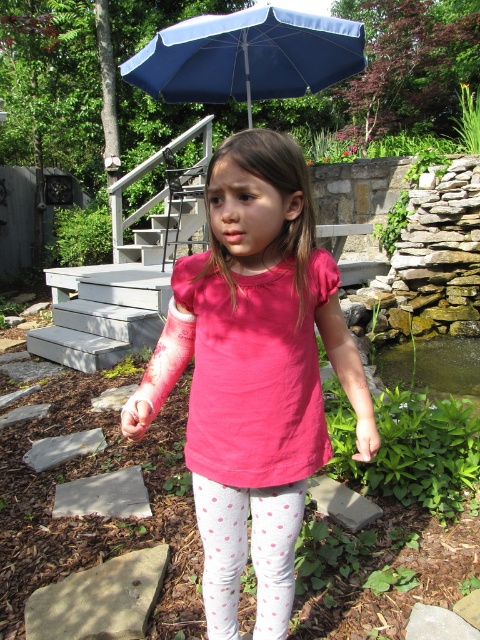
Question: Which of the following is the closest to the observer?

Choices:
 (A) blue fabric umbrella at upper center
 (B) white polka dot leggings at lower center
 (C) pink fabric shirt at center

Answer: (C)

Question: Does blue fabric umbrella at upper center appear on the left side of white polka dot leggings at lower center?

Choices:
 (A) yes
 (B) no

Answer: (B)

Question: Is pink fabric shirt at center positioned before white polka dot leggings at lower center?

Choices:
 (A) yes
 (B) no

Answer: (A)

Question: Which point is closer to the camera?

Choices:
 (A) blue fabric umbrella at upper center
 (B) pink fabric shirt at center

Answer: (B)

Question: Does pink fabric shirt at center have a smaller size compared to blue fabric umbrella at upper center?

Choices:
 (A) no
 (B) yes

Answer: (B)

Question: Which of the following is the closest to the observer?

Choices:
 (A) blue fabric umbrella at upper center
 (B) white polka dot leggings at lower center

Answer: (B)